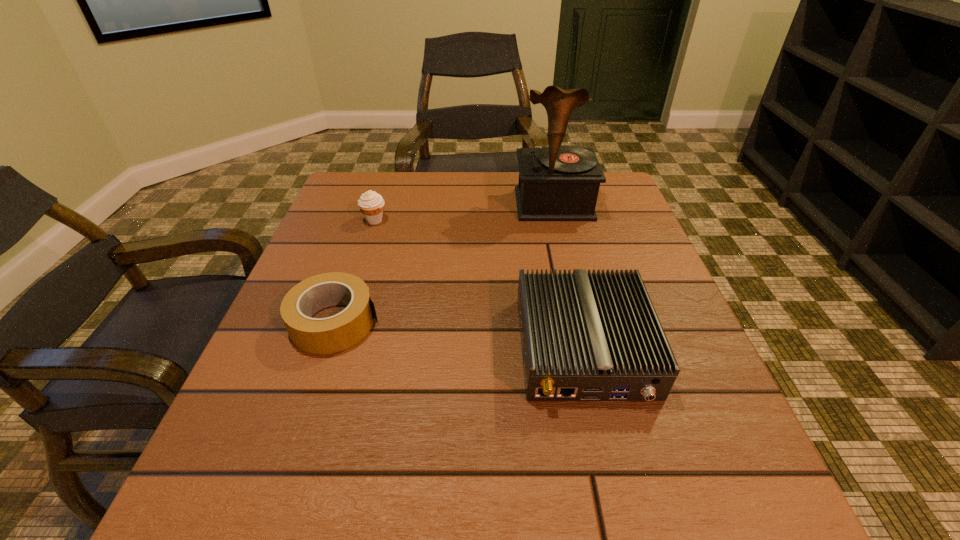
What are the coordinates of `muffin positioned at the left edge` in the screenshot? It's located at (371, 204).

Identify the location of duct tape present at the left edge. The height and width of the screenshot is (540, 960). (333, 334).

This screenshot has width=960, height=540. I want to click on phonograph_record that is positioned at the right edge, so click(x=560, y=183).

This screenshot has width=960, height=540. I want to click on router at the right edge, so click(585, 337).

The image size is (960, 540). I want to click on object situated at the far left corner, so click(371, 204).

Find the location of a particular element. The image size is (960, 540). object positioned at the far right corner is located at coordinates (560, 183).

This screenshot has width=960, height=540. I want to click on vacant space at the far edge of the desktop, so click(x=399, y=204).

The image size is (960, 540). I want to click on free space at the near edge of the desktop, so click(571, 468).

In the image, there is a desktop. Identify the location of vacant space at the left edge. Image resolution: width=960 pixels, height=540 pixels. (279, 334).

Where is `vacant space at the right edge`? The width and height of the screenshot is (960, 540). vacant space at the right edge is located at coordinates (708, 366).